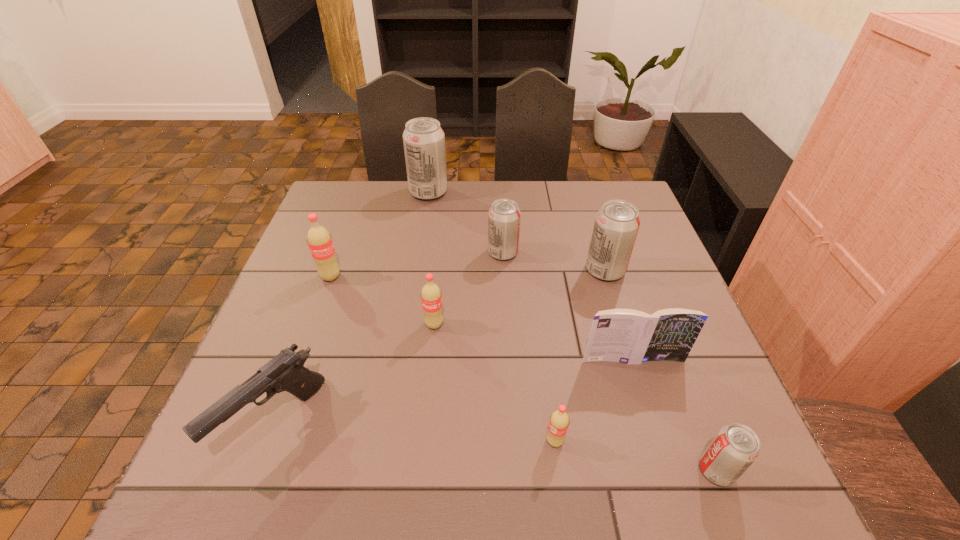
This screenshot has width=960, height=540. I want to click on object at the near left corner, so click(x=285, y=372).

Locate an element on the screen. The height and width of the screenshot is (540, 960). object located in the near right corner section of the desktop is located at coordinates (735, 447).

The width and height of the screenshot is (960, 540). In order to click on vacant space at the far edge of the desktop in this screenshot , I will do `click(588, 217)`.

What are the coordinates of `free space at the near edge of the desktop` in the screenshot? It's located at (469, 468).

This screenshot has height=540, width=960. I want to click on vacant space at the left edge of the desktop, so click(x=329, y=233).

Locate an element on the screen. Image resolution: width=960 pixels, height=540 pixels. vacant region at the right edge is located at coordinates (660, 428).

Find the location of `free space at the far right corner of the desktop`. free space at the far right corner of the desktop is located at coordinates 597,200.

The image size is (960, 540). Identify the location of vacant space at the near right corner of the desktop. (766, 497).

Find the location of a particular element. The width and height of the screenshot is (960, 540). empty location between the book and the fifth object from right to left is located at coordinates (567, 306).

The width and height of the screenshot is (960, 540). What are the coordinates of `free spot between the fourth soda can from right to left and the rightmost red soda` in the screenshot? It's located at (529, 347).